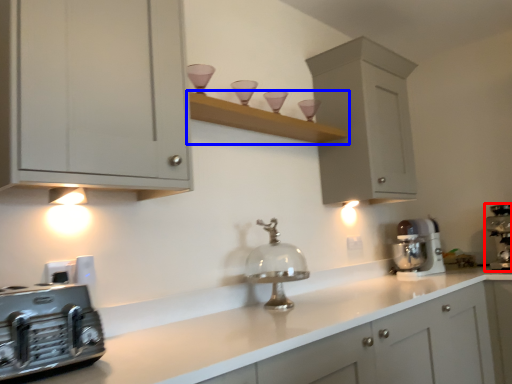
Question: Which of the following is the closest to the observer, home appliance (highlighted by a red box) or shelf (highlighted by a blue box)?

Choices:
 (A) home appliance
 (B) shelf

Answer: (B)